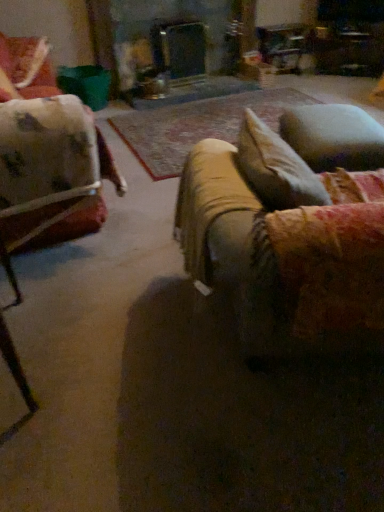
Question: Is velvet beige couch at center facing towards velvety blue pillow at right?

Choices:
 (A) no
 (B) yes

Answer: (B)

Question: From a real-world perspective, is velvet beige couch at center located higher than velvety blue pillow at right?

Choices:
 (A) yes
 (B) no

Answer: (A)

Question: From a real-world perspective, is velvet beige couch at center below velvety blue pillow at right?

Choices:
 (A) yes
 (B) no

Answer: (B)

Question: Are velvet beige couch at center and velvety blue pillow at right far apart?

Choices:
 (A) no
 (B) yes

Answer: (A)

Question: Can you confirm if velvet beige couch at center is shorter than velvety blue pillow at right?

Choices:
 (A) no
 (B) yes

Answer: (A)

Question: Can you confirm if velvet beige couch at center is taller than velvety blue pillow at right?

Choices:
 (A) yes
 (B) no

Answer: (A)

Question: Is velvet beige couch at center shorter than velvet floral chair at upper left?

Choices:
 (A) no
 (B) yes

Answer: (A)

Question: Is velvet beige couch at center behind velvet floral chair at upper left?

Choices:
 (A) yes
 (B) no

Answer: (B)

Question: Does velvet beige couch at center have a greater height compared to velvet floral chair at upper left?

Choices:
 (A) no
 (B) yes

Answer: (B)

Question: From the image's perspective, would you say velvet beige couch at center is positioned over velvet floral chair at upper left?

Choices:
 (A) no
 (B) yes

Answer: (A)

Question: Can you confirm if velvet beige couch at center is thinner than velvet floral chair at upper left?

Choices:
 (A) yes
 (B) no

Answer: (B)

Question: Is there a large distance between velvet beige couch at center and velvet floral chair at upper left?

Choices:
 (A) yes
 (B) no

Answer: (A)

Question: Considering the relative positions of velvety blue pillow at right and velvet beige couch at center in the image provided, is velvety blue pillow at right to the left of velvet beige couch at center from the viewer's perspective?

Choices:
 (A) yes
 (B) no

Answer: (B)